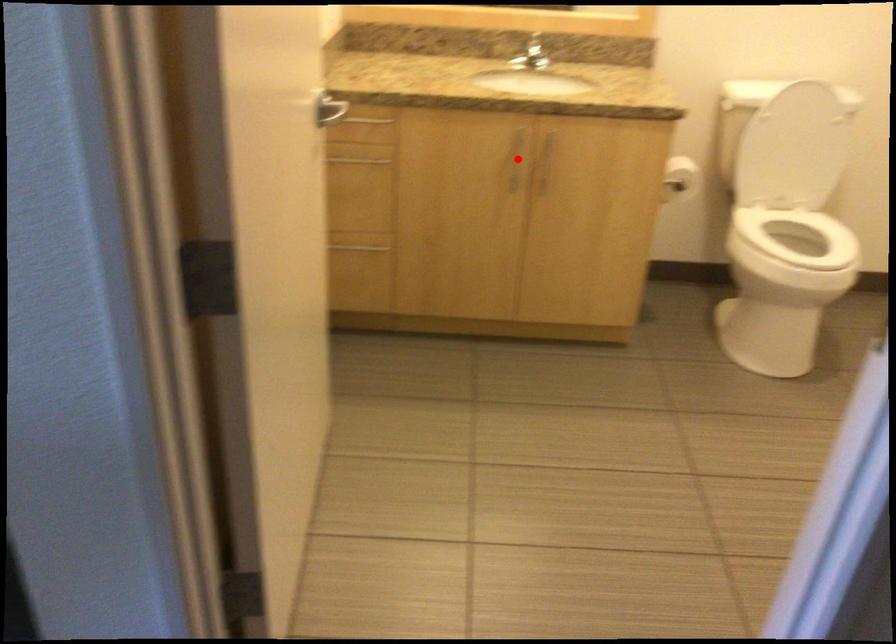
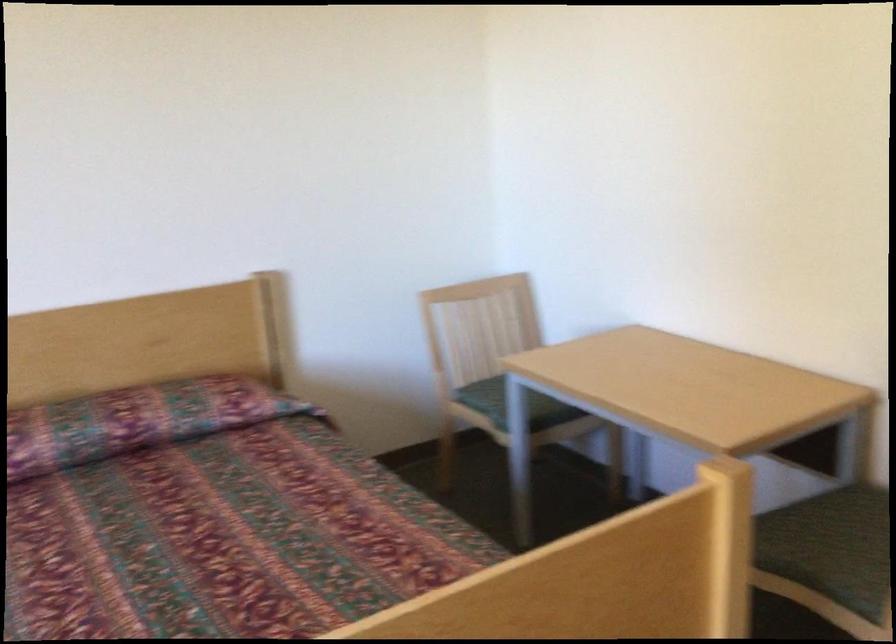
Question: I am providing you with two images of the same scene from different viewpoints. A red point is marked on the first image. At the location where the point appears in image 1, is it still visible in image 2?

Choices:
 (A) Yes
 (B) No

Answer: (B)